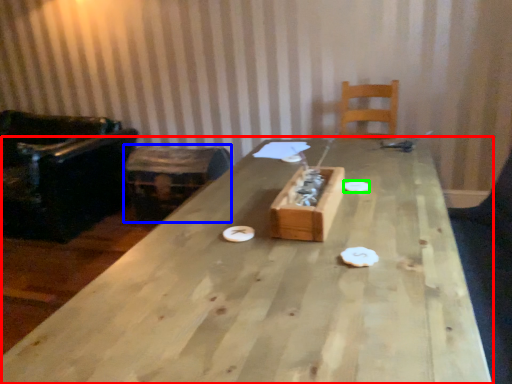
Question: Which object is positioned farthest from table (highlighted by a red box)? Select from storage box (highlighted by a blue box) and paper plate (highlighted by a green box).

Choices:
 (A) storage box
 (B) paper plate

Answer: (A)